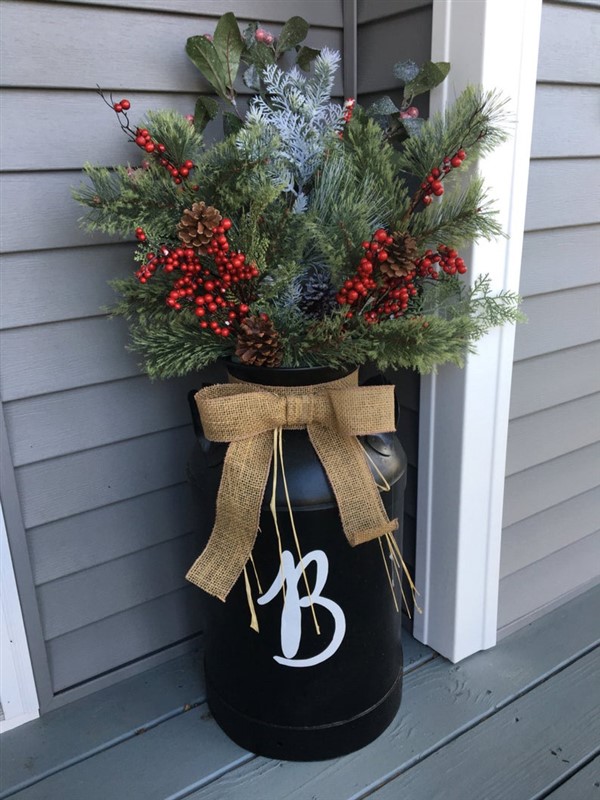
Find the location of a particular element. The height and width of the screenshot is (800, 600). door is located at coordinates (19, 700).